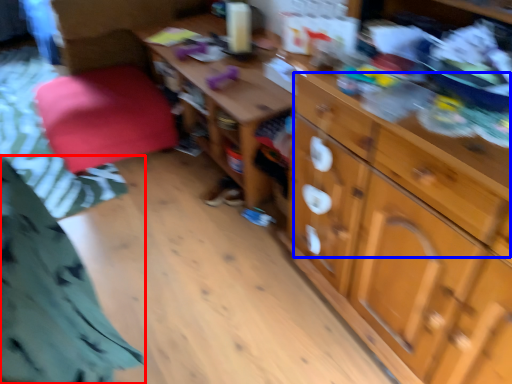
Question: Which of the following is the closest to the observer, clothing (highlighted by a red box) or drawer (highlighted by a blue box)?

Choices:
 (A) clothing
 (B) drawer

Answer: (A)